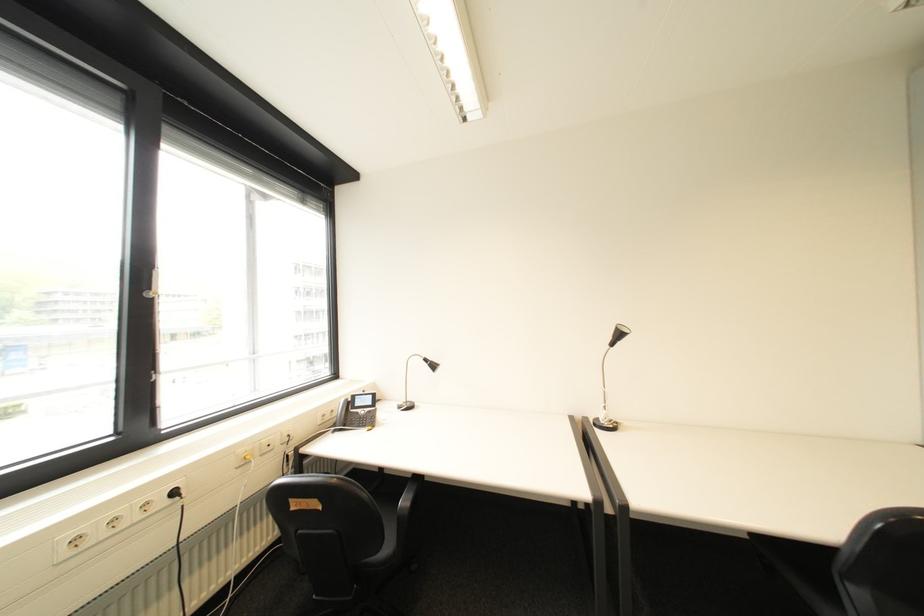
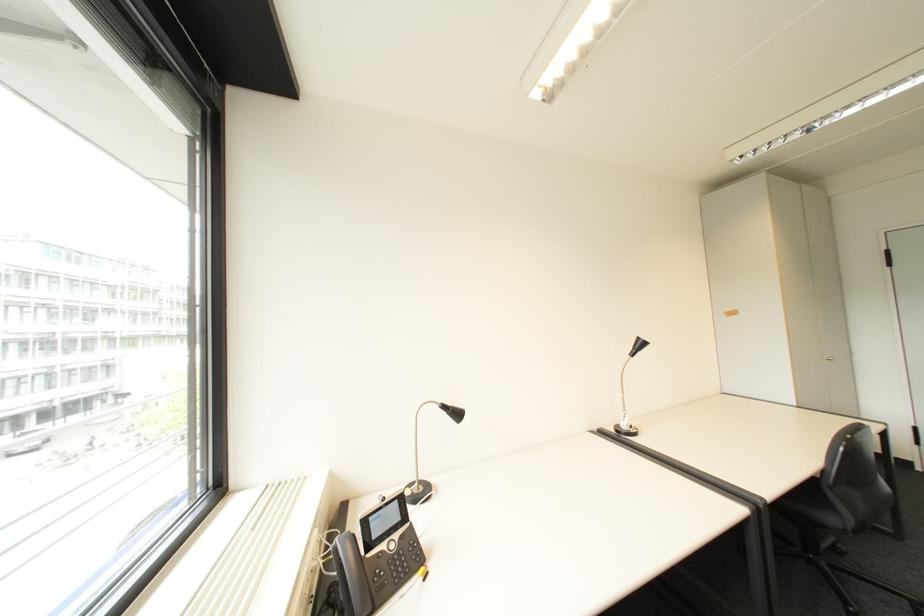
Find the pixel in the second image that matches [619,339] in the first image.

(640, 350)